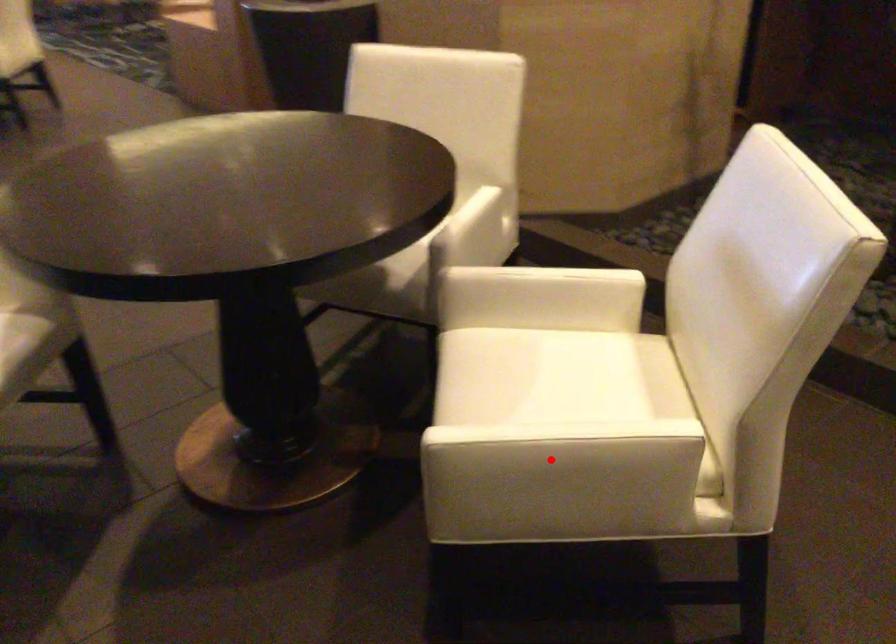
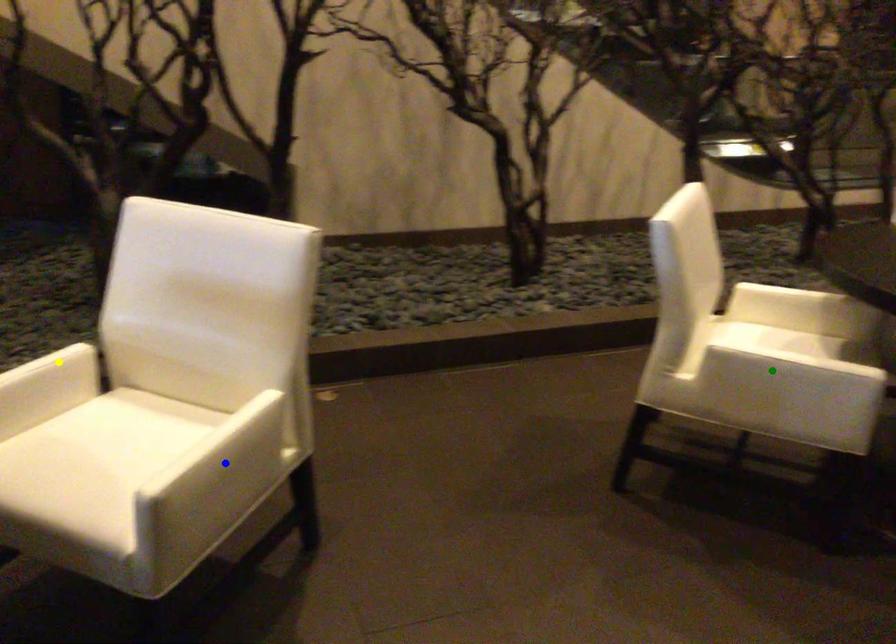
Question: I am providing you with two images of the same scene from different viewpoints. A red point is marked on the first image. You are given multiple points on the second image. In image 2, which mark is for the same physical point as the one in image 1?

Choices:
 (A) yellow point
 (B) green point
 (C) blue point

Answer: (C)